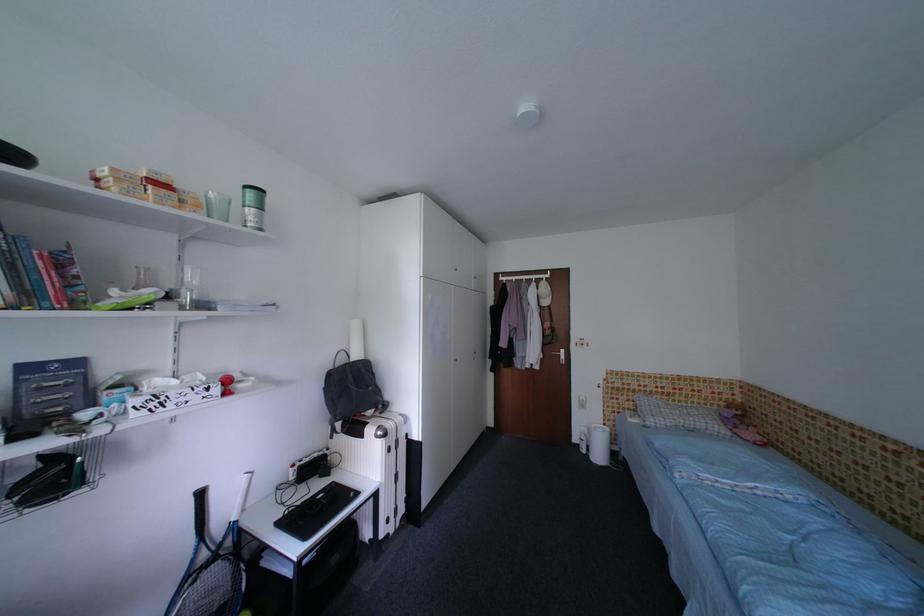
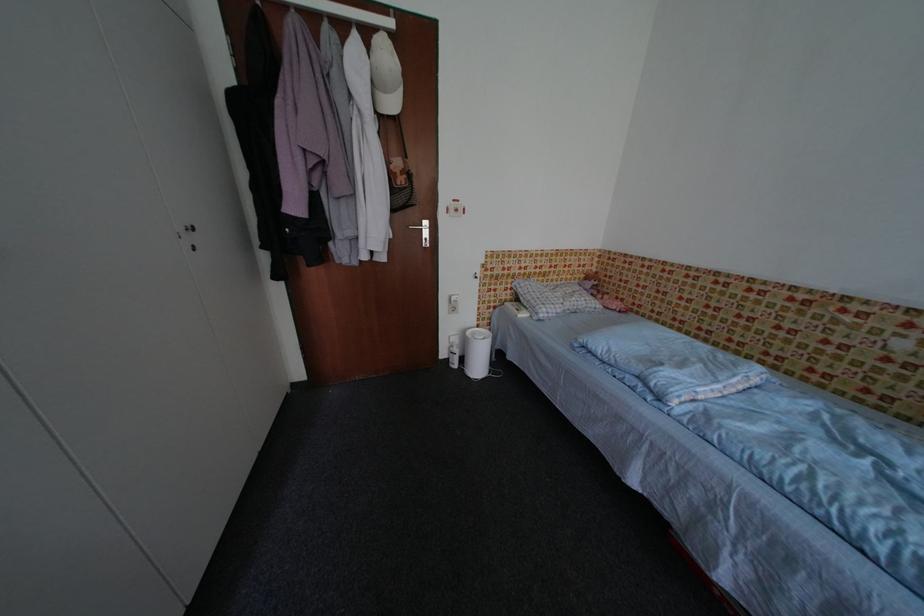
Find the pixel in the second image that matches (x=586, y=448) in the first image.

(455, 363)